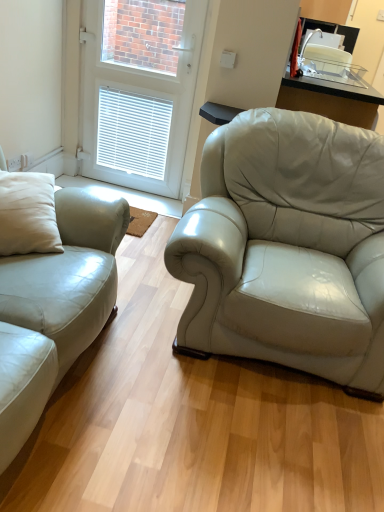
Locate an element on the screen. The width and height of the screenshot is (384, 512). vacant area that lies in front of white glossy door at upper center is located at coordinates (141, 203).